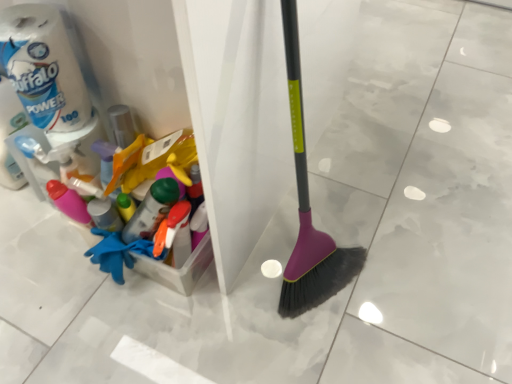
Question: Should I look upward or downward to see white matte toilet paper at upper left, the 1th toilet paper in the right-to-left sequence?

Choices:
 (A) up
 (B) down

Answer: (A)

Question: Does white matte toilet paper at upper left, which ranks as the second toilet paper in left-to-right order, come in front of white matte toilet paper at left, arranged as the 1th toilet paper when viewed from the left?

Choices:
 (A) yes
 (B) no

Answer: (A)

Question: Is white matte toilet paper at left, arranged as the 1th toilet paper when viewed from the left, completely or partially inside white matte toilet paper at upper left, the 1th toilet paper in the right-to-left sequence?

Choices:
 (A) yes
 (B) no

Answer: (B)

Question: Is white matte toilet paper at upper left, the 1th toilet paper in the right-to-left sequence, positioned far away from white matte toilet paper at left, arranged as the 1th toilet paper when viewed from the left?

Choices:
 (A) yes
 (B) no

Answer: (B)

Question: From a real-world perspective, is white matte toilet paper at upper left, the 1th toilet paper in the right-to-left sequence, physically above white matte toilet paper at left, arranged as the 1th toilet paper when viewed from the left?

Choices:
 (A) no
 (B) yes

Answer: (B)

Question: Is white matte toilet paper at upper left, which ranks as the second toilet paper in left-to-right order, to the left of white matte toilet paper at left, which is the second toilet paper in right-to-left order, from the viewer's perspective?

Choices:
 (A) yes
 (B) no

Answer: (B)

Question: Does white matte toilet paper at upper left, the 1th toilet paper in the right-to-left sequence, appear on the right side of white matte toilet paper at left, which is the second toilet paper in right-to-left order?

Choices:
 (A) yes
 (B) no

Answer: (A)

Question: Is white matte toilet paper at left, arranged as the 1th toilet paper when viewed from the left, next to white matte toilet paper at upper left, the 1th toilet paper in the right-to-left sequence, and touching it?

Choices:
 (A) yes
 (B) no

Answer: (B)

Question: Is white matte toilet paper at left, arranged as the 1th toilet paper when viewed from the left, at the right side of white matte toilet paper at upper left, the 1th toilet paper in the right-to-left sequence?

Choices:
 (A) no
 (B) yes

Answer: (A)

Question: Can you confirm if white matte toilet paper at left, arranged as the 1th toilet paper when viewed from the left, is shorter than white matte toilet paper at upper left, which ranks as the second toilet paper in left-to-right order?

Choices:
 (A) no
 (B) yes

Answer: (A)

Question: Is white matte toilet paper at left, which is the second toilet paper in right-to-left order, further to camera compared to white matte toilet paper at upper left, which ranks as the second toilet paper in left-to-right order?

Choices:
 (A) yes
 (B) no

Answer: (A)

Question: From the image's perspective, would you say white matte toilet paper at left, which is the second toilet paper in right-to-left order, is positioned over white matte toilet paper at upper left, which ranks as the second toilet paper in left-to-right order?

Choices:
 (A) yes
 (B) no

Answer: (B)

Question: From a real-world perspective, is white matte toilet paper at left, which is the second toilet paper in right-to-left order, over white matte toilet paper at upper left, the 1th toilet paper in the right-to-left sequence?

Choices:
 (A) yes
 (B) no

Answer: (B)

Question: From the image's perspective, is white matte toilet paper at upper left, the 1th toilet paper in the right-to-left sequence, positioned above or below white matte toilet paper at left, which is the second toilet paper in right-to-left order?

Choices:
 (A) below
 (B) above

Answer: (B)